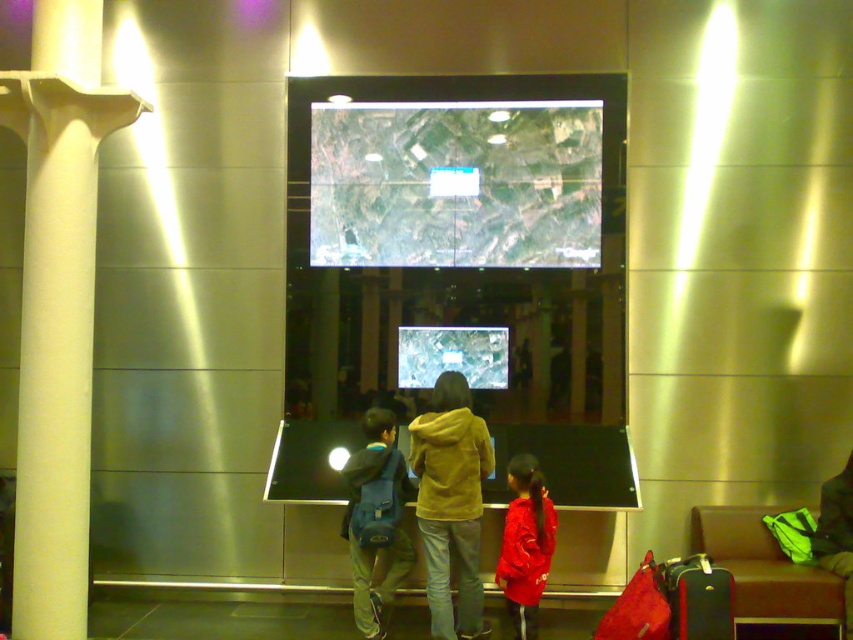
The height and width of the screenshot is (640, 853). I want to click on white smooth column at left, so click(x=56, y=339).

Is white smooth column at left thinner than yellow fleece jacket at center?

No, white smooth column at left is not thinner than yellow fleece jacket at center.

Between point (22, 541) and point (463, 595), which one is positioned in front?

Point (22, 541)

Where is `white smooth column at left`? Image resolution: width=853 pixels, height=640 pixels. white smooth column at left is located at coordinates (56, 339).

In the scene shown: Between white smooth column at left and blue fabric backpack at center, which one is positioned lower?

blue fabric backpack at center is below.

Does point (67, 125) lie behind point (373, 449)?

No.

Is point (85, 401) positioned in front of point (404, 548)?

Yes.

Locate an element on the screen. white smooth column at left is located at coordinates (56, 339).

Can you confirm if red fleece jacket at lower right is taller than green fabric bag at lower right?

Yes, red fleece jacket at lower right is taller than green fabric bag at lower right.

Does point (537, 524) lie in front of point (842, 490)?

Yes, it is.

Where is `red fleece jacket at lower right`? The image size is (853, 640). red fleece jacket at lower right is located at coordinates (525, 545).